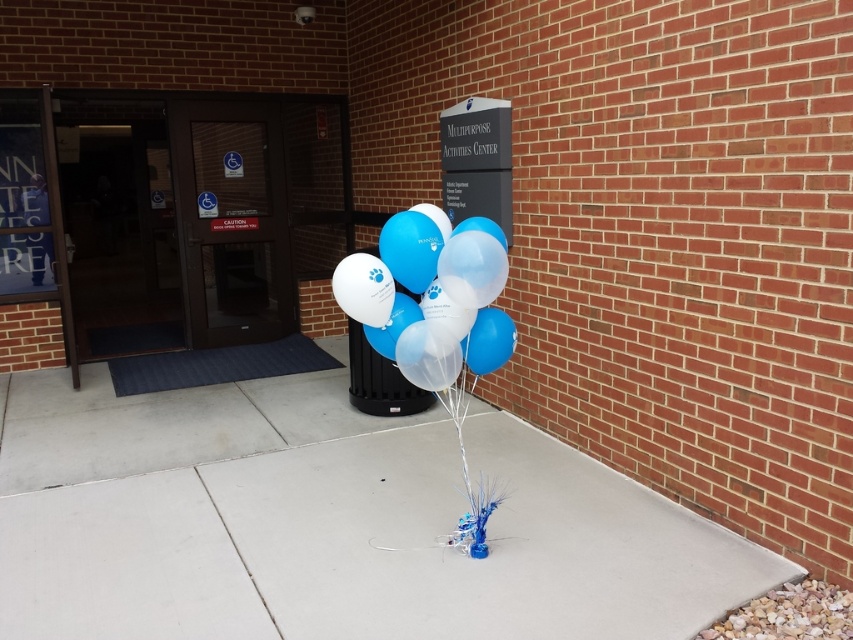
Is point (281, 413) more distant than point (399, 272)?

Yes, point (281, 413) is behind point (399, 272).

Can you confirm if white concrete pavement at center is bigger than translucent glossy balloons at center?

Correct, white concrete pavement at center is larger in size than translucent glossy balloons at center.

Where is `white concrete pavement at center`? This screenshot has height=640, width=853. white concrete pavement at center is located at coordinates (329, 524).